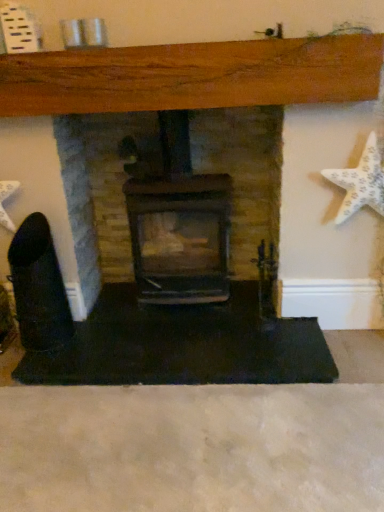
Question: Is matte black fireplace at center, which is the second fireplace in left-to-right order, smaller than black matte fireplace at center, marked as the 1th fireplace in a left-to-right arrangement?

Choices:
 (A) no
 (B) yes

Answer: (B)

Question: Does matte black fireplace at center, which is the 1th fireplace from right to left, have a greater height compared to black matte fireplace at center, the second fireplace viewed from the right?

Choices:
 (A) yes
 (B) no

Answer: (A)

Question: From the image's perspective, is matte black fireplace at center, which is the 1th fireplace from right to left, over black matte fireplace at center, marked as the 1th fireplace in a left-to-right arrangement?

Choices:
 (A) yes
 (B) no

Answer: (A)

Question: From a real-world perspective, does matte black fireplace at center, which is the 1th fireplace from right to left, stand above black matte fireplace at center, marked as the 1th fireplace in a left-to-right arrangement?

Choices:
 (A) no
 (B) yes

Answer: (B)

Question: Is the depth of matte black fireplace at center, which is the 1th fireplace from right to left, less than that of black matte fireplace at center, marked as the 1th fireplace in a left-to-right arrangement?

Choices:
 (A) no
 (B) yes

Answer: (B)

Question: From a real-world perspective, is matte black fireplace at center, which is the 1th fireplace from right to left, above or below white textured starfish at right?

Choices:
 (A) above
 (B) below

Answer: (B)

Question: Looking at their shapes, would you say matte black fireplace at center, which is the second fireplace in left-to-right order, is wider or thinner than white textured starfish at right?

Choices:
 (A) wide
 (B) thin

Answer: (B)

Question: Is matte black fireplace at center, which is the second fireplace in left-to-right order, spatially inside white textured starfish at right, or outside of it?

Choices:
 (A) outside
 (B) inside

Answer: (A)

Question: Considering the relative positions of matte black fireplace at center, which is the 1th fireplace from right to left, and white textured starfish at right in the image provided, is matte black fireplace at center, which is the 1th fireplace from right to left, to the left or to the right of white textured starfish at right?

Choices:
 (A) right
 (B) left

Answer: (B)

Question: Considering their positions, is black matte fireplace at center, the second fireplace viewed from the right, located in front of or behind matte black fireplace at center, which is the second fireplace in left-to-right order?

Choices:
 (A) front
 (B) behind

Answer: (B)

Question: From a real-world perspective, is black matte fireplace at center, marked as the 1th fireplace in a left-to-right arrangement, physically located above or below matte black fireplace at center, which is the 1th fireplace from right to left?

Choices:
 (A) above
 (B) below

Answer: (B)

Question: Is point (67, 188) positioned closer to the camera than point (54, 71)?

Choices:
 (A) closer
 (B) farther

Answer: (B)

Question: Is black matte fireplace at center, marked as the 1th fireplace in a left-to-right arrangement, bigger or smaller than matte black fireplace at center, which is the second fireplace in left-to-right order?

Choices:
 (A) small
 (B) big

Answer: (B)

Question: From their relative heights in the image, would you say white textured starfish at right is taller or shorter than black matte fireplace at center, marked as the 1th fireplace in a left-to-right arrangement?

Choices:
 (A) tall
 (B) short

Answer: (B)

Question: In terms of size, does white textured starfish at right appear bigger or smaller than black matte fireplace at center, the second fireplace viewed from the right?

Choices:
 (A) small
 (B) big

Answer: (A)